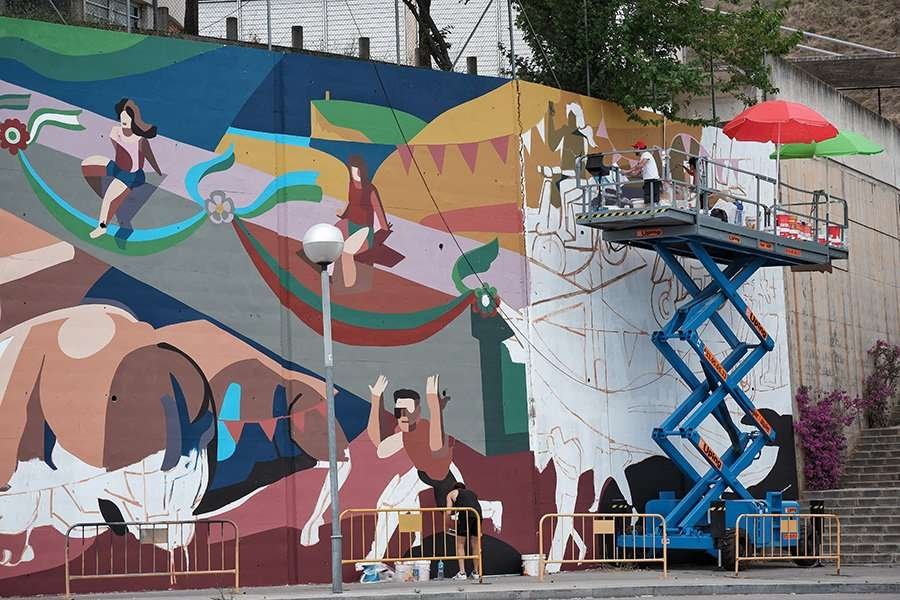
The width and height of the screenshot is (900, 600). What are the coordinates of `blue paint` in the screenshot? It's located at point(171,415).